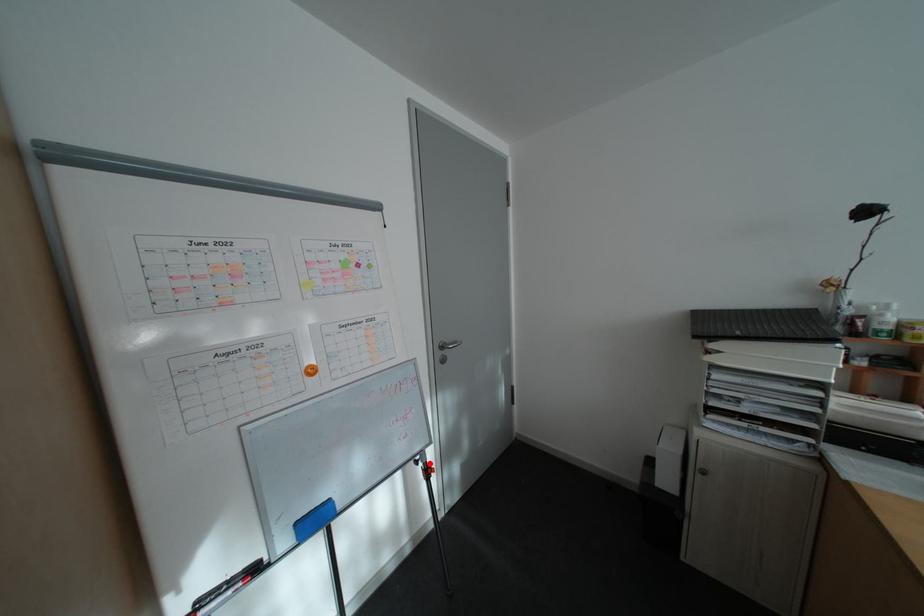
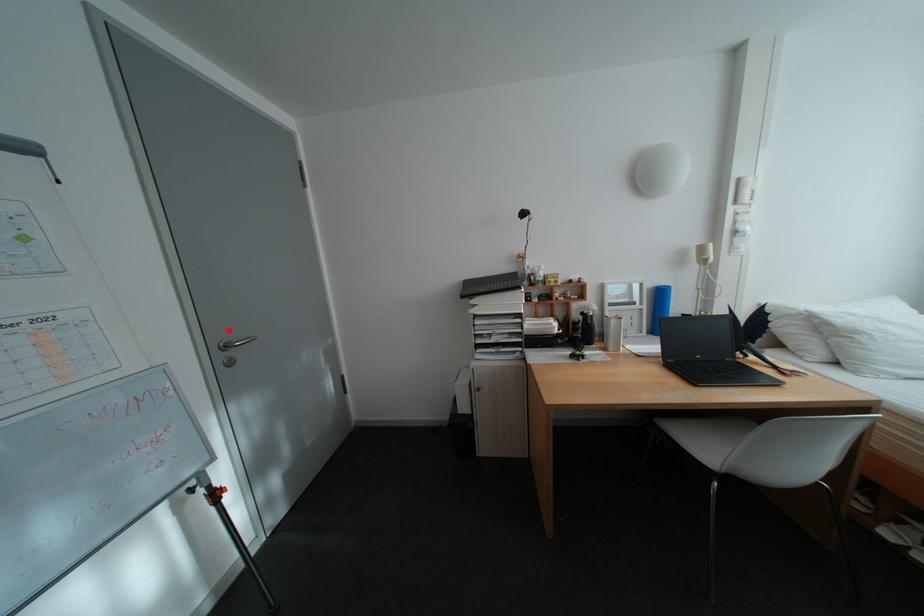
I am providing you with two images of the same scene from different viewpoints. A red point is marked on the first image and another point is marked on the second image. Is the red point in image1 aligned with the point shown in image2?

No